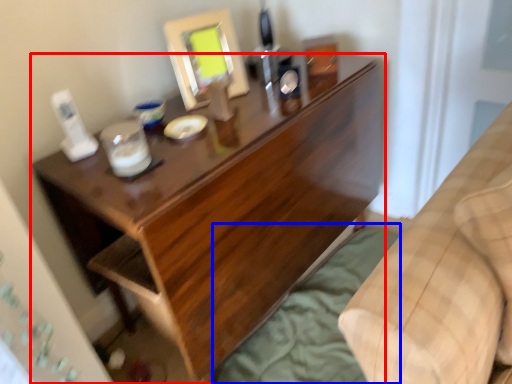
Question: Which object is further to the camera taking this photo, desk (highlighted by a red box) or sheet (highlighted by a blue box)?

Choices:
 (A) desk
 (B) sheet

Answer: (B)